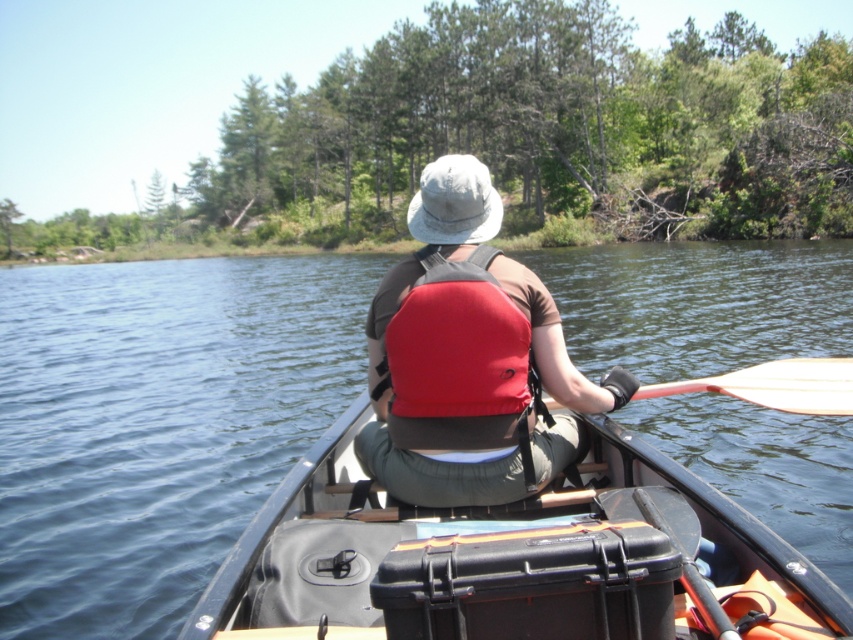
Find the location of a particular element. red fabric life vest at center is located at coordinates (468, 358).

Which is behind, point (383, 355) or point (737, 396)?

The point (737, 396) is more distant.

The width and height of the screenshot is (853, 640). Identify the location of red fabric life vest at center. (468, 358).

I want to click on red fabric life vest at center, so click(x=468, y=358).

Is red fabric life vest at center above red fabric life jacket at center?

Indeed, red fabric life vest at center is positioned over red fabric life jacket at center.

Between red fabric life vest at center and red fabric life jacket at center, which one appears on the left side from the viewer's perspective?

red fabric life jacket at center

This screenshot has width=853, height=640. Find the location of `red fabric life vest at center`. red fabric life vest at center is located at coordinates click(x=468, y=358).

Who is lower down, red fabric life jacket at center or wooden smooth paddle at right?

wooden smooth paddle at right is below.

Between point (456, 436) and point (784, 406), which one is positioned behind?

Positioned behind is point (784, 406).

What are the coordinates of `red fabric life jacket at center` in the screenshot? It's located at (448, 429).